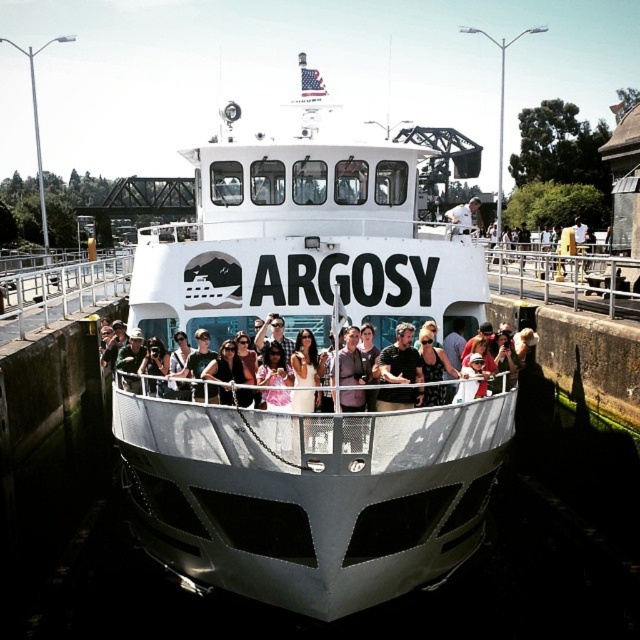
Looking at this image, you are a photographer standing on the dock next to the ferry. You want to take a photo of the white matte boat at center and the white fabric shirt at center. How far apart are these two objects in meters?

The distance between the white matte boat at center and the white fabric shirt at center is 8.27 meters.

From the picture: You are a photographer on the ferry and want to ensure both the matte black shirt at center and dark gray shirt at center are visible in your photo. Since the ferry is narrow, you need to know which shirt is wider to frame the shot properly. Which shirt has a greater width?

The matte black shirt at center has a greater width than the dark gray shirt at center.